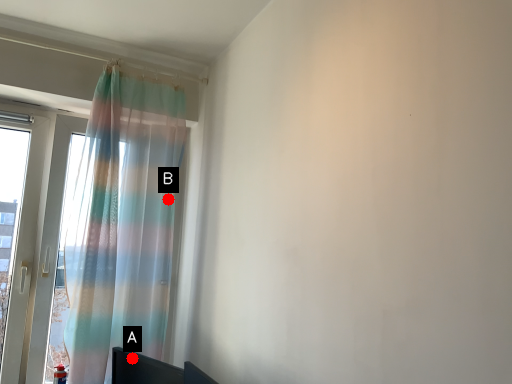
Question: Two points are circled on the image, labeled by A and B beside each circle. Which point is farther from the camera taking this photo?

Choices:
 (A) A is further
 (B) B is further

Answer: (B)